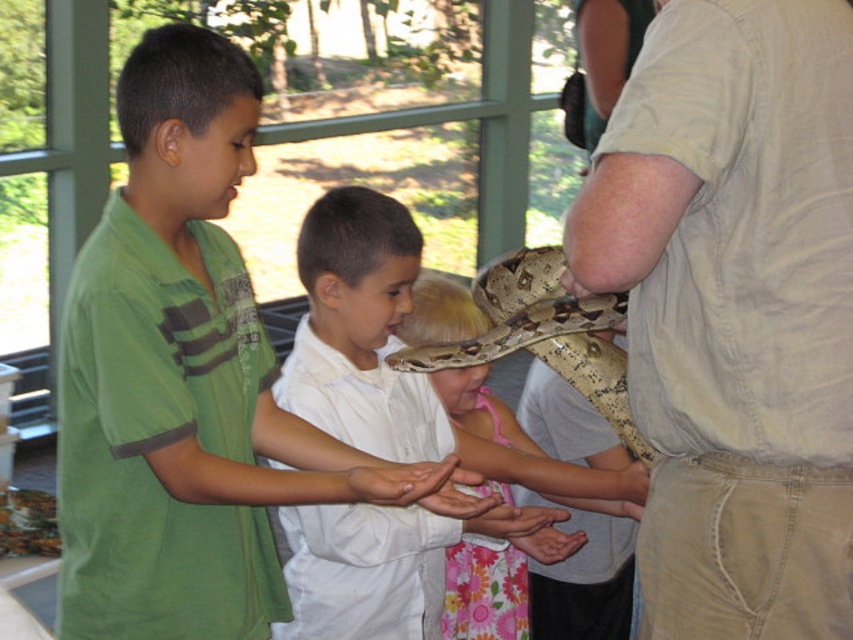
Question: Can you confirm if green matte shirt at left is smaller than brown scaly snake at center?

Choices:
 (A) no
 (B) yes

Answer: (A)

Question: Is smooth white shirt at center positioned in front of smooth beige snake at center?

Choices:
 (A) yes
 (B) no

Answer: (A)

Question: Which is nearer to the green matte neck at left?

Choices:
 (A) matte white shirt at center
 (B) smooth beige snake at center
 (C) light beige cotton shirt at right

Answer: (A)

Question: Is smooth beige snake at center wider than green matte neck at left?

Choices:
 (A) no
 (B) yes

Answer: (B)

Question: Considering the real-world distances, which object is closest to the green matte neck at left?

Choices:
 (A) matte white shirt at center
 (B) green matte shirt at left
 (C) smooth beige snake at center
 (D) brown scaly snake at center

Answer: (B)

Question: Which point is closer to the camera?

Choices:
 (A) [505, 280]
 (B) [363, 344]
 (C) [173, 221]

Answer: (C)